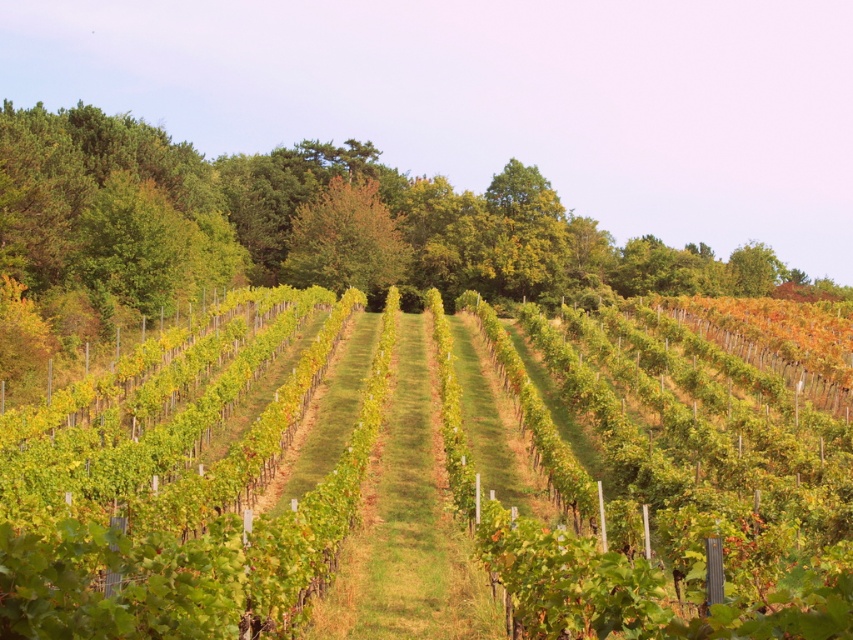
You are a gardener planning to install a new irrigation system in the vineyard. You need to determine which area between the green leafy vines at center and the green leafy tree at center requires more water. Based on their sizes, which one should receive more water?

The green leafy vines at center might be wider than green leafy tree at center, so they should receive more water.

You are standing in the vineyard and want to walk from the green leafy tree at center to the green leafy vines at center. Which direction should you walk to reach them?

You should walk to the right to reach the green leafy vines at center because the green leafy vines at center is to the right of the green leafy tree at center.

Looking at this image, you are standing at the center of the vineyard and see the green leafy vines at center. Where exactly are they located in terms of coordinates?

The green leafy vines at center are located at coordinates point (650, 484).